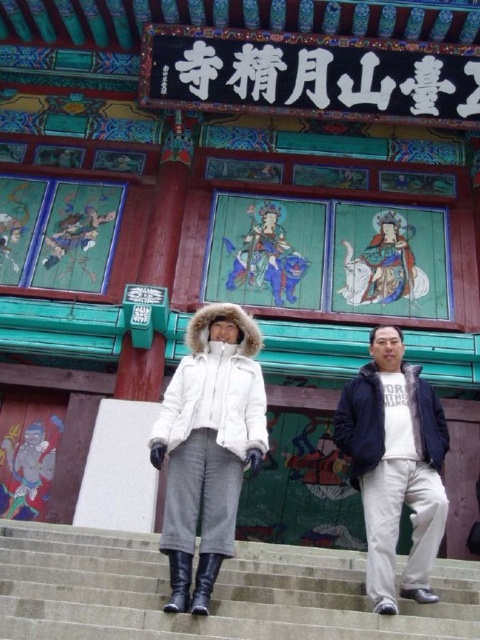
Question: Which is nearer to the gray concrete stairs at center?

Choices:
 (A) white cotton pants at right
 (B) white fur-trimmed coat at center

Answer: (B)

Question: Does gray concrete stairs at center lie behind white cotton pants at right?

Choices:
 (A) no
 (B) yes

Answer: (A)

Question: Can you confirm if white fur-trimmed coat at center is positioned above white cotton pants at right?

Choices:
 (A) yes
 (B) no

Answer: (A)

Question: Is the position of gray concrete stairs at center more distant than that of white fur-trimmed coat at center?

Choices:
 (A) no
 (B) yes

Answer: (A)

Question: Estimate the real-world distances between objects in this image. Which object is farther from the gray concrete stairs at center?

Choices:
 (A) white fur-trimmed coat at center
 (B) white cotton pants at right

Answer: (B)

Question: Estimate the real-world distances between objects in this image. Which object is farther from the white cotton pants at right?

Choices:
 (A) gray concrete stairs at center
 (B) white fur-trimmed coat at center

Answer: (A)